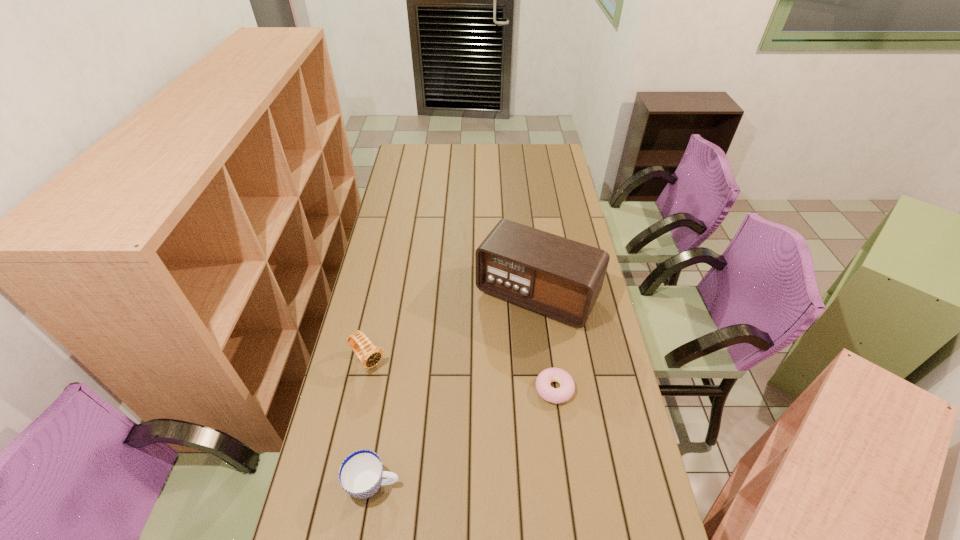
Locate an element on the screen. empty space between the shortest object and the tallest object is located at coordinates (545, 342).

You are a GUI agent. You are given a task and a screenshot of the screen. Output one action in this format:
    pyautogui.click(x=<x>, y=<y>)
    Task: Click on the vacant space in between the doughnut and the watch
    
    Given the screenshot: What is the action you would take?
    pyautogui.click(x=461, y=375)

At what (x,y) coordinates should I click in order to perform the action: click on free space between the cup and the watch. Please return your answer as a coordinate pair (x, y). Image resolution: width=960 pixels, height=540 pixels. Looking at the image, I should click on (371, 422).

The height and width of the screenshot is (540, 960). I want to click on free point between the tallest object and the watch, so click(452, 328).

Locate an element on the screen. free space between the second tallest object and the nearest object is located at coordinates (371, 422).

Locate an element on the screen. object identified as the third closest to the watch is located at coordinates (567, 386).

I want to click on the third closest object to the doughnut, so click(370, 355).